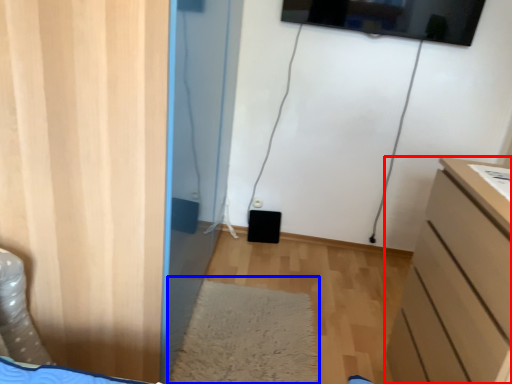
Question: Which of the following is the closest to the observer, chest of drawers (highlighted by a red box) or mat (highlighted by a blue box)?

Choices:
 (A) chest of drawers
 (B) mat

Answer: (A)